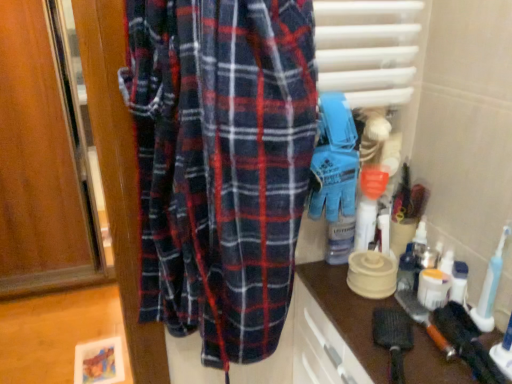
This screenshot has height=384, width=512. Find the location of `vacant space situated on the left part of black rubber toothbrush at lower right`. vacant space situated on the left part of black rubber toothbrush at lower right is located at coordinates (348, 303).